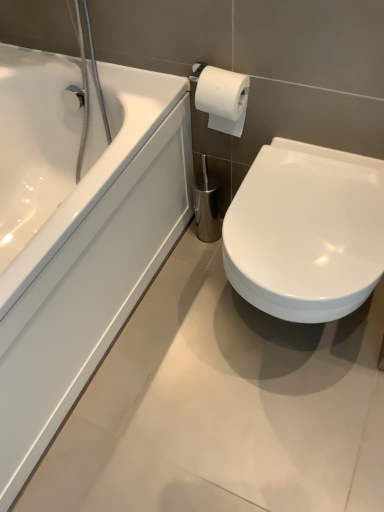
Question: Is point (13, 95) closer or farther from the camera than point (314, 154)?

Choices:
 (A) closer
 (B) farther

Answer: (B)

Question: Relative to white glossy toilet at lower right, is white glossy bathtub at left in front or behind?

Choices:
 (A) behind
 (B) front

Answer: (B)

Question: Is white glossy bathtub at left bigger or smaller than white glossy toilet at lower right?

Choices:
 (A) big
 (B) small

Answer: (A)

Question: Is white glossy toilet at lower right wider or thinner than white glossy bathtub at left?

Choices:
 (A) wide
 (B) thin

Answer: (B)

Question: Is point (296, 148) closer or farther from the camera than point (107, 111)?

Choices:
 (A) farther
 (B) closer

Answer: (B)

Question: From the image's perspective, is white glossy toilet at lower right above or below white glossy bathtub at left?

Choices:
 (A) below
 (B) above

Answer: (A)

Question: From a real-world perspective, relative to white glossy bathtub at left, is white glossy toilet at lower right vertically above or below?

Choices:
 (A) below
 (B) above

Answer: (A)